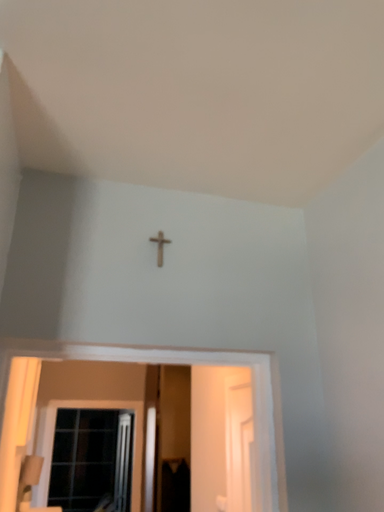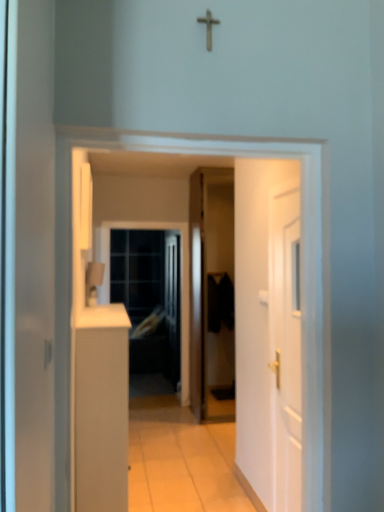
Question: Which way did the camera rotate in the video?

Choices:
 (A) rotated upward
 (B) rotated downward

Answer: (B)